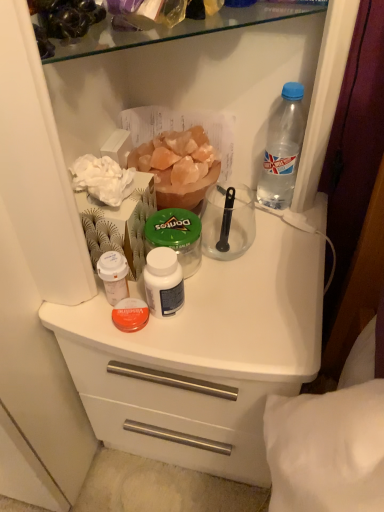
Question: Is green plastic jar at center not within white matte plastic counter at center?

Choices:
 (A) no
 (B) yes

Answer: (B)

Question: Does green plastic jar at center have a greater height compared to white matte plastic counter at center?

Choices:
 (A) yes
 (B) no

Answer: (B)

Question: Can you see green plastic jar at center touching white matte plastic counter at center?

Choices:
 (A) yes
 (B) no

Answer: (B)

Question: Considering the relative positions of green plastic jar at center and white matte plastic counter at center in the image provided, is green plastic jar at center to the right of white matte plastic counter at center from the viewer's perspective?

Choices:
 (A) no
 (B) yes

Answer: (A)

Question: Does green plastic jar at center have a greater width compared to white matte plastic counter at center?

Choices:
 (A) yes
 (B) no

Answer: (B)

Question: Is white matte plastic cup at upper left, which is counted as the first bottle, starting from the bottom, wider or thinner than white matte plastic counter at center?

Choices:
 (A) wide
 (B) thin

Answer: (B)

Question: Based on their positions, is white matte plastic cup at upper left, marked as the second bottle in a top-to-bottom arrangement, located to the left or right of white matte plastic counter at center?

Choices:
 (A) left
 (B) right

Answer: (A)

Question: Considering the positions of white matte plastic cup at upper left, marked as the second bottle in a top-to-bottom arrangement, and white matte plastic counter at center in the image, is white matte plastic cup at upper left, marked as the second bottle in a top-to-bottom arrangement, bigger or smaller than white matte plastic counter at center?

Choices:
 (A) big
 (B) small

Answer: (B)

Question: From a real-world perspective, relative to white matte plastic counter at center, is white matte plastic cup at upper left, marked as the second bottle in a top-to-bottom arrangement, vertically above or below?

Choices:
 (A) above
 (B) below

Answer: (A)

Question: Is point (160, 231) positioned closer to the camera than point (122, 268)?

Choices:
 (A) closer
 (B) farther

Answer: (B)

Question: Considering the positions of green plastic jar at center and white matte plastic cup at upper left, marked as the second bottle in a top-to-bottom arrangement, in the image, is green plastic jar at center taller or shorter than white matte plastic cup at upper left, marked as the second bottle in a top-to-bottom arrangement,?

Choices:
 (A) short
 (B) tall

Answer: (B)

Question: Looking at their shapes, would you say green plastic jar at center is wider or thinner than white matte plastic cup at upper left, the 2th bottle when ordered from right to left?

Choices:
 (A) thin
 (B) wide

Answer: (B)

Question: From the image's perspective, is green plastic jar at center located above or below white matte plastic cup at upper left, positioned as the 1th bottle in left-to-right order?

Choices:
 (A) above
 (B) below

Answer: (A)

Question: In terms of width, does white matte plastic counter at center look wider or thinner when compared to orange crystal salt at center?

Choices:
 (A) thin
 (B) wide

Answer: (B)

Question: From a real-world perspective, relative to orange crystal salt at center, is white matte plastic counter at center vertically above or below?

Choices:
 (A) above
 (B) below

Answer: (B)